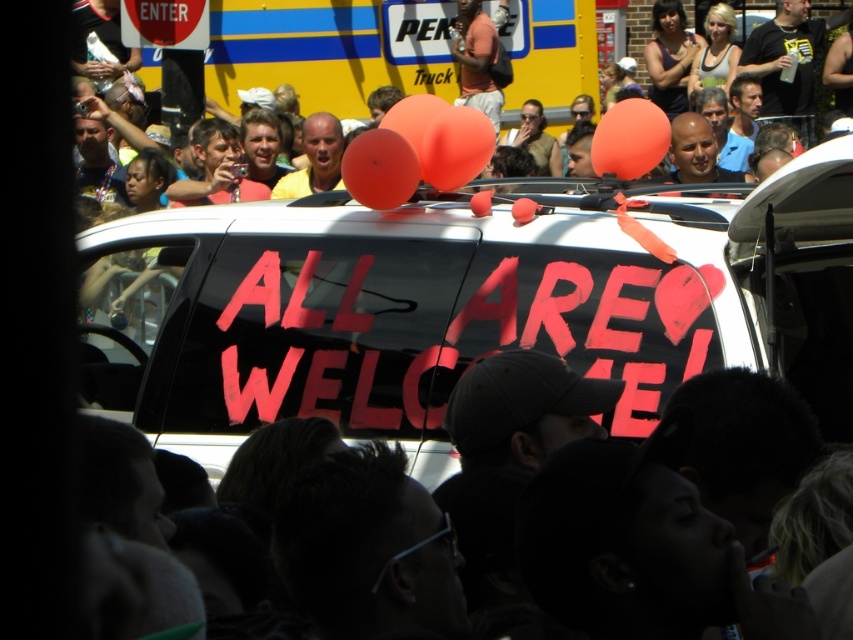
Question: Considering the real-world distances, which object is farthest from the rubber balloon at center?

Choices:
 (A) rubber matte balloon at center
 (B) matte black car at upper center

Answer: (B)

Question: Is white matte police van at center above rubber balloon at center?

Choices:
 (A) yes
 (B) no

Answer: (B)

Question: Which object is positioned closest to the white matte police van at center?

Choices:
 (A) matte black car at upper center
 (B) rubber matte balloon at center

Answer: (B)

Question: Considering the relative positions of matte black car at upper center and rubber balloon at center in the image provided, where is matte black car at upper center located with respect to rubber balloon at center?

Choices:
 (A) left
 (B) right

Answer: (B)

Question: Is matte black car at upper center below rubber matte balloon at center?

Choices:
 (A) no
 (B) yes

Answer: (A)

Question: Which point is farther to the camera?

Choices:
 (A) (140, 220)
 (B) (123, 54)
 (C) (392, 106)

Answer: (B)